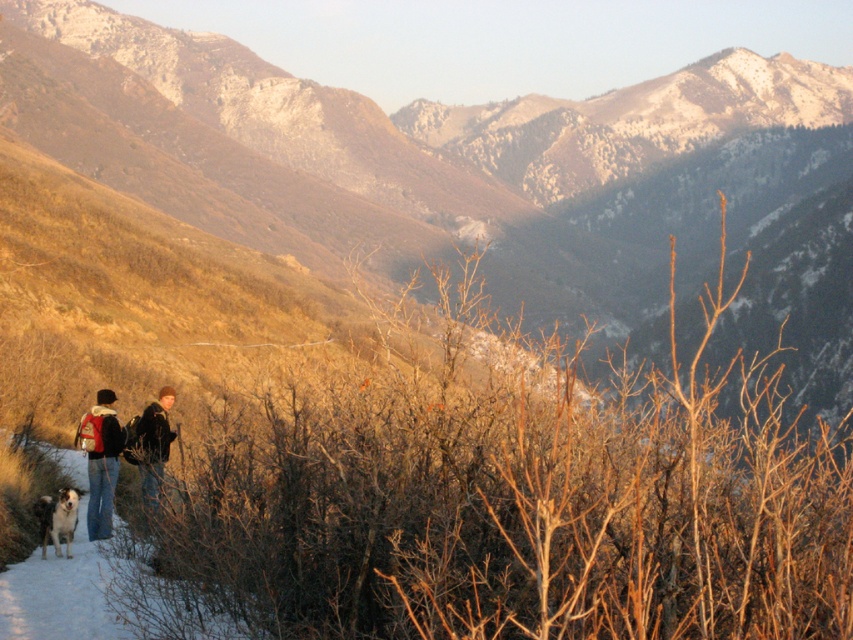
Question: Observing the image, what is the correct spatial positioning of denim jacket at lower left in reference to black and white fur dog at lower left?

Choices:
 (A) right
 (B) left

Answer: (B)

Question: Is matte black backpacks at lower left bigger than black leather jacket at center?

Choices:
 (A) no
 (B) yes

Answer: (B)

Question: Which point is closer to the camera?

Choices:
 (A) (88, 504)
 (B) (164, 404)
 (C) (100, 476)

Answer: (A)

Question: Which is farther from the black and white fur dog at lower left?

Choices:
 (A) black leather jacket at center
 (B) brown grassy hillside at lower left
 (C) matte black backpacks at lower left

Answer: (B)

Question: Which point is closer to the camera?

Choices:
 (A) brown grassy hillside at lower left
 (B) black leather jacket at center

Answer: (B)

Question: Is denim jacket at lower left further to the viewer compared to black leather jacket at center?

Choices:
 (A) yes
 (B) no

Answer: (A)